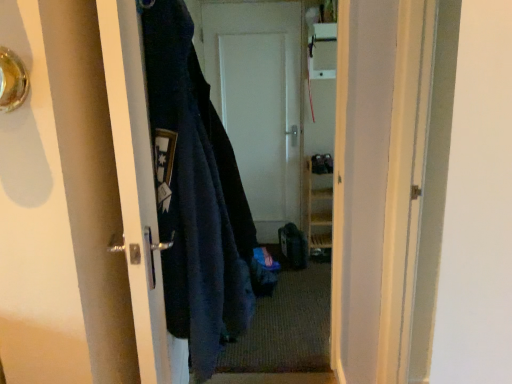
Question: Is the depth of matte black door handle at left, which is the first door from left to right, less than that of metallic silver door handle at upper left?

Choices:
 (A) no
 (B) yes

Answer: (A)

Question: Does matte black door handle at left, the 2th door viewed from the right, have a larger size compared to metallic silver door handle at upper left?

Choices:
 (A) yes
 (B) no

Answer: (A)

Question: Is matte black door handle at left, the 1th door when ordered from front to back, outside metallic silver door handle at upper left?

Choices:
 (A) no
 (B) yes

Answer: (B)

Question: From the image's perspective, does matte black door handle at left, the 2th door viewed from the right, appear lower than metallic silver door handle at upper left?

Choices:
 (A) yes
 (B) no

Answer: (A)

Question: Is metallic silver door handle at upper left inside matte black door handle at left, which is the first door from left to right?

Choices:
 (A) no
 (B) yes

Answer: (A)

Question: Does matte black door handle at left, which is counted as the second door, starting from the back, appear on the right side of metallic silver door handle at upper left?

Choices:
 (A) yes
 (B) no

Answer: (A)

Question: Is metallic silver door handle at upper left oriented towards matte black door handle at left, the 1th door when ordered from front to back?

Choices:
 (A) no
 (B) yes

Answer: (A)

Question: From the image's perspective, is metallic silver door handle at upper left below matte black door handle at left, the 1th door when ordered from front to back?

Choices:
 (A) yes
 (B) no

Answer: (B)

Question: Considering the relative positions of metallic silver door handle at upper left and matte black door handle at left, which is the first door from left to right, in the image provided, is metallic silver door handle at upper left behind matte black door handle at left, which is the first door from left to right,?

Choices:
 (A) yes
 (B) no

Answer: (B)

Question: Does metallic silver door handle at upper left have a larger size compared to matte black door handle at left, the 2th door viewed from the right?

Choices:
 (A) no
 (B) yes

Answer: (A)

Question: Is metallic silver door handle at upper left taller than matte black door handle at left, which is counted as the second door, starting from the back?

Choices:
 (A) yes
 (B) no

Answer: (B)

Question: Can we say metallic silver door handle at upper left lies outside matte black door handle at left, the 1th door when ordered from front to back?

Choices:
 (A) yes
 (B) no

Answer: (A)

Question: From the image's perspective, is matte black door handle at left, the 1th door when ordered from front to back, located beneath dark blue fuzzy jacket at left?

Choices:
 (A) yes
 (B) no

Answer: (A)